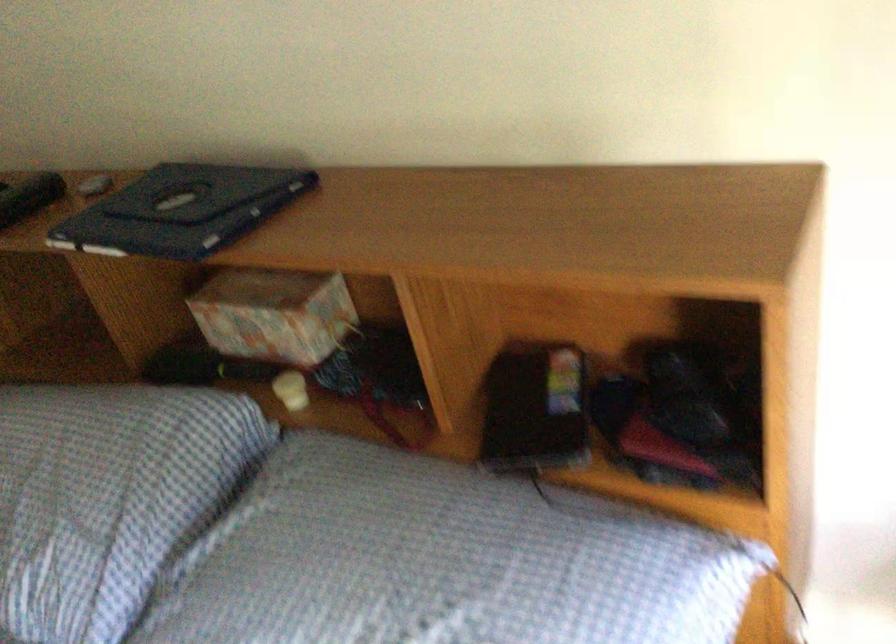
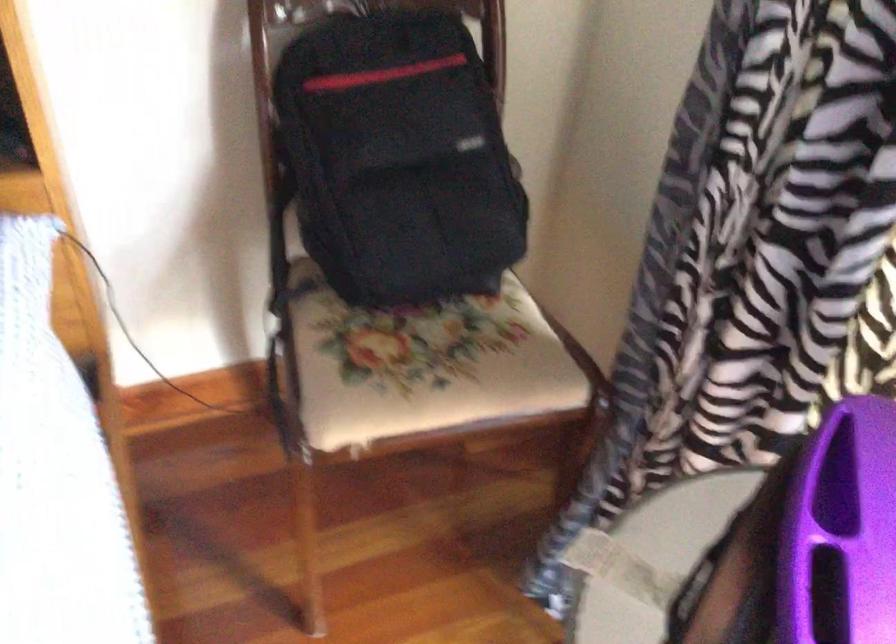
Question: Based on the continuous images, in which direction is the camera rotating? Reply with the corresponding letter.

Choices:
 (A) Left
 (B) Right
 (C) Up
 (D) Down

Answer: (B)